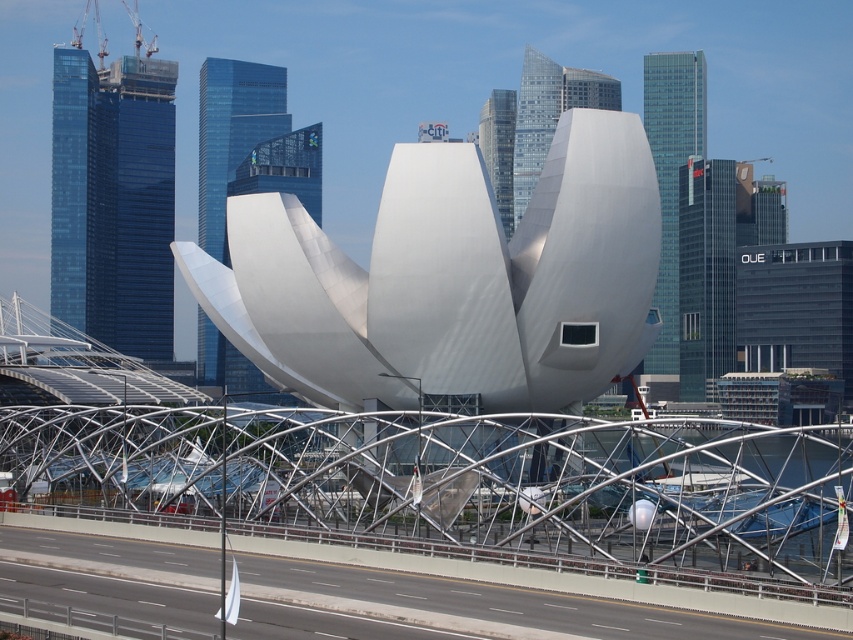
Question: Estimate the real-world distances between objects in this image. Which object is farther from the gray asphalt highway at lower center?

Choices:
 (A) satin silver sculpture at center
 (B) metallic silver bridge at center

Answer: (A)

Question: Estimate the real-world distances between objects in this image. Which object is farther from the satin silver sculpture at center?

Choices:
 (A) metallic silver bridge at center
 (B) gray asphalt highway at lower center

Answer: (B)

Question: Can you confirm if metallic silver bridge at center is positioned below gray asphalt highway at lower center?

Choices:
 (A) no
 (B) yes

Answer: (A)

Question: Can you confirm if metallic silver bridge at center is thinner than gray asphalt highway at lower center?

Choices:
 (A) yes
 (B) no

Answer: (B)

Question: Which point appears closest to the camera in this image?

Choices:
 (A) (323, 262)
 (B) (444, 580)

Answer: (B)

Question: Does metallic silver bridge at center have a larger size compared to satin silver sculpture at center?

Choices:
 (A) yes
 (B) no

Answer: (B)